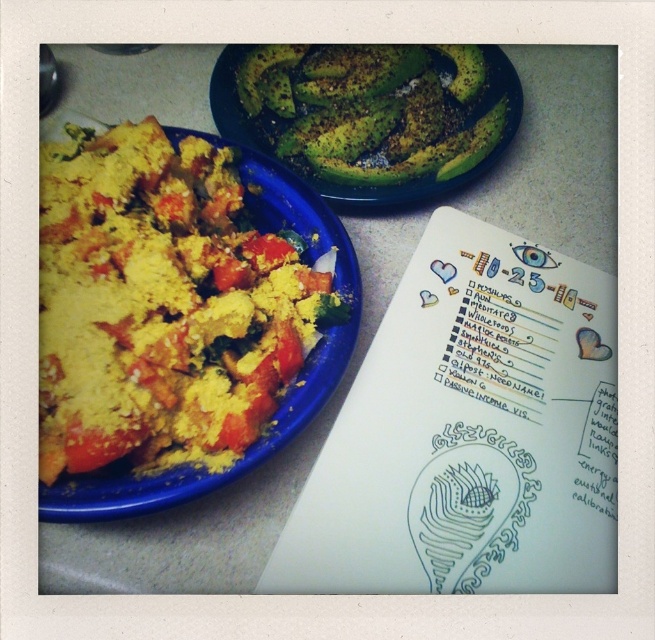
You are standing in front of the dining setup and want to pick up the item closer to you. Which point should you reach for, point (234, 284) or point (388, 100)?

Point (234, 284) is closer to the camera, so you should reach for point (234, 284).

You are a food critic standing at the edge of the countertop. You want to reach for the green matte avocado at upper center but need to avoid the yellow crumbly at left. Which direction should you move your hand to safely grab the avocado without touching the crumbly?

You should move your hand to the right, as the yellow crumbly at left is positioned to the left of the green matte avocado at upper center. This way, you can avoid the crumbly and reach the avocado safely.